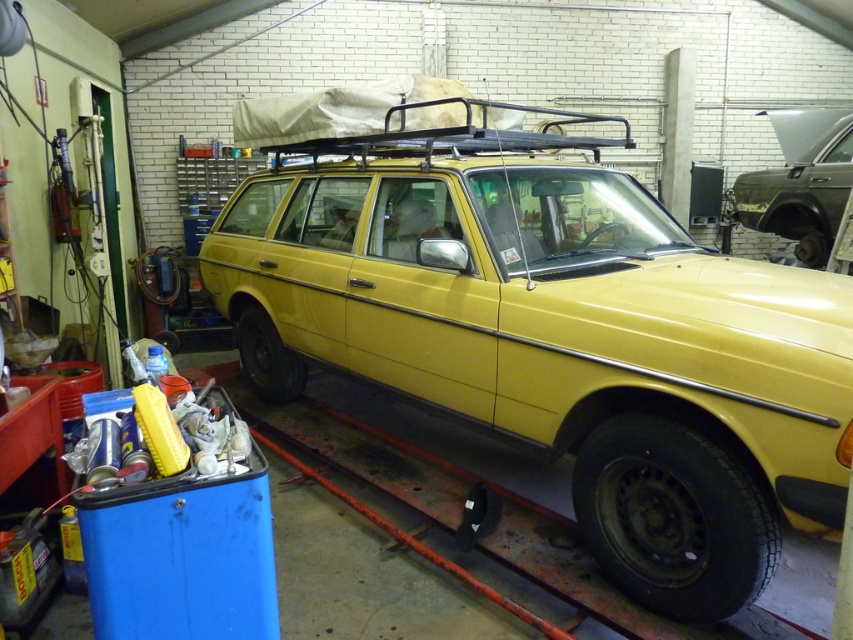
Is point (795, 272) behind point (811, 204)?

No, (795, 272) is closer to viewer.

Does point (599, 276) come in front of point (792, 214)?

Yes.

Between point (698, 449) and point (751, 173), which one is positioned behind?

The point (751, 173) is more distant.

Identify the location of yellow matte station wagon at center. This screenshot has width=853, height=640. (556, 337).